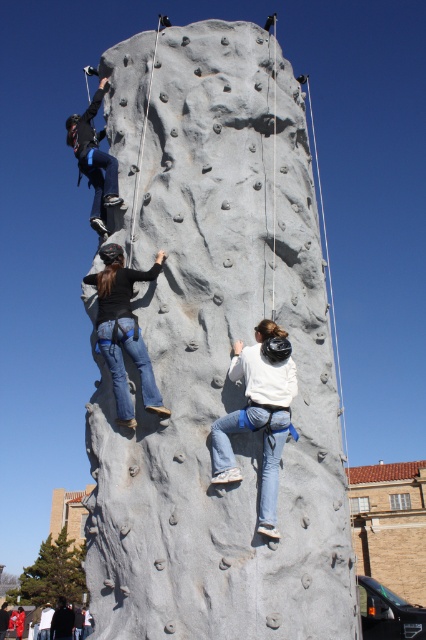
You are a safety inspector checking the climbing wall and helmet. Which object is wider, the smooth concrete rock climbing at center or the matte black helmet at center?

The smooth concrete rock climbing at center is wider than the matte black helmet at center.

You are a safety inspector checking the climbing wall. You notice two climbers with the matte black helmet at center and the matte blue pants at upper left. Which climber has a narrower helmet?

The matte black helmet at center has a width less than the matte blue pants at upper left, so the climber with the matte black helmet at center has a narrower helmet.